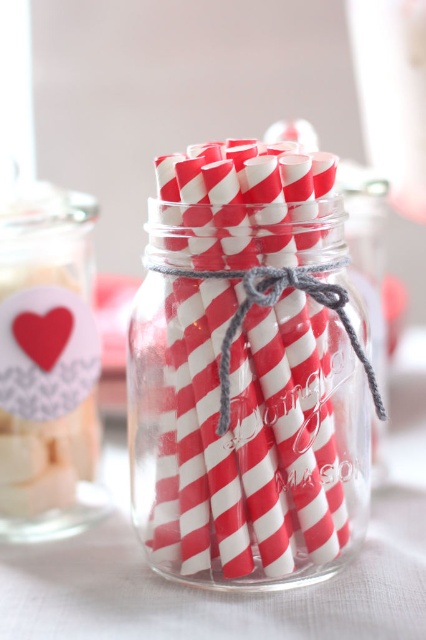
Is point (103, 497) positioned after point (60, 348)?

Yes, it is.

At what (x,y) coordinates should I click in order to perform the action: click on matte white glass jar at upper left. Please return your answer as a coordinate pair (x, y). Image resolution: width=426 pixels, height=640 pixels. Looking at the image, I should click on (46, 364).

I want to click on matte white glass jar at upper left, so click(46, 364).

Can you confirm if red striped straws at center is positioned below matte white glass jar at upper left?

Yes.

Is point (256, 253) positioned before point (28, 298)?

Yes, point (256, 253) is closer to viewer.

Is point (190, 257) positioned before point (29, 237)?

Yes, it is in front of point (29, 237).

The image size is (426, 640). In order to click on red striped straws at center in this screenshot , I will do `click(247, 396)`.

Between red striped straws at center and matte paper heart at center, which one has less height?

matte paper heart at center

Is red striped straws at center taller than matte paper heart at center?

Indeed, red striped straws at center has a greater height compared to matte paper heart at center.

Where is `red striped straws at center`? red striped straws at center is located at coordinates pyautogui.click(x=247, y=396).